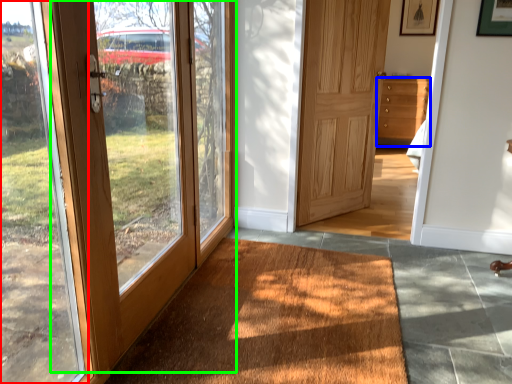
Question: Considering the real-world distances, which object is farthest from window frame (highlighted by a red box)? chest of drawers (highlighted by a blue box) or door (highlighted by a green box)?

Choices:
 (A) chest of drawers
 (B) door

Answer: (A)